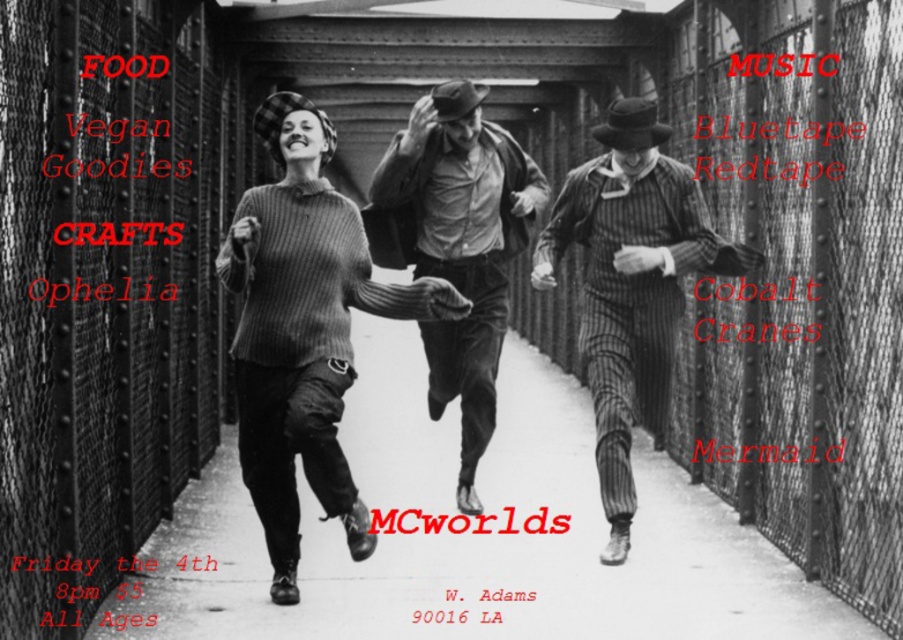
You are a photographer trying to capture a candid shot of the knitted sweater at center and the striped wool suit at center while they are running. Your camera has a maximum focus range of 1.5 meters. Can you focus on both subjects simultaneously?

The distance between the knitted sweater at center and the striped wool suit at center is 1.70 meters. Since your camera can only focus within 1.5 meters, you cannot focus on both subjects at the same time.

You are a photographer who wants to capture a photo of the knitted sweater at center and the smooth leather jacket at center. Based on their positions, which one is closer to the left side of the frame?

The knitted sweater at center is to the left of the smooth leather jacket at center, so it is closer to the left side of the frame.

You are standing at the point with coordinates point (436, 218) and want to reach the point with coordinates point (714, 262). Given the scene described, which direction should you move to get there?

You should move forward because point (714, 262) is in front of point (436, 218).